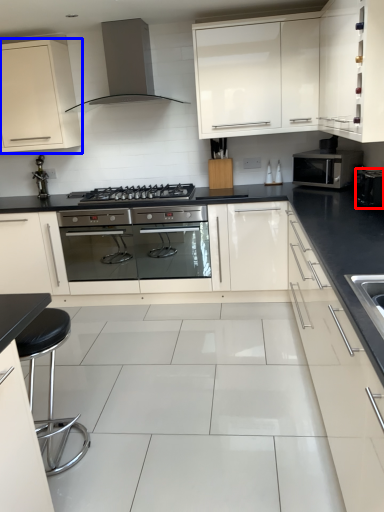
Question: Among these objects, which one is farthest to the camera, appliance (highlighted by a red box) or cabinetry (highlighted by a blue box)?

Choices:
 (A) appliance
 (B) cabinetry

Answer: (B)